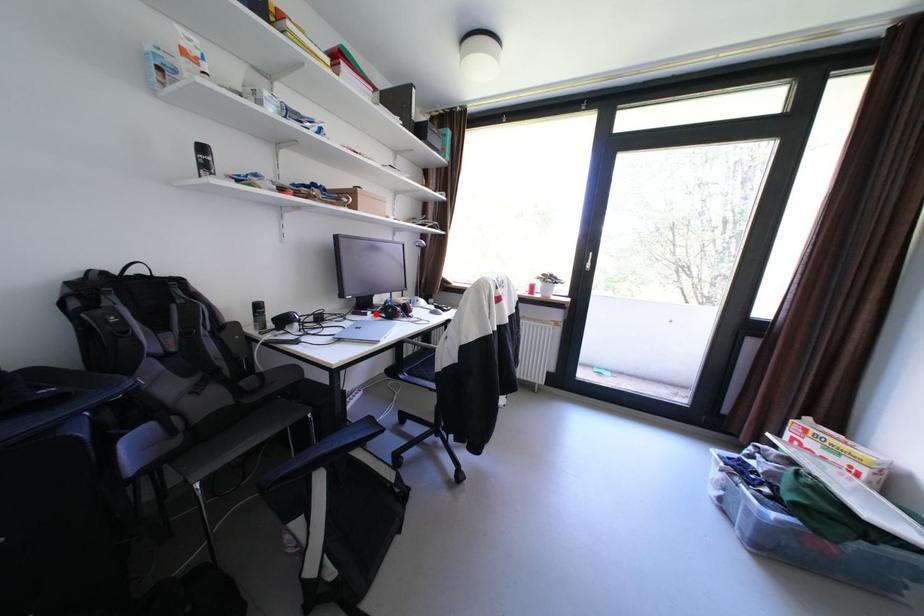
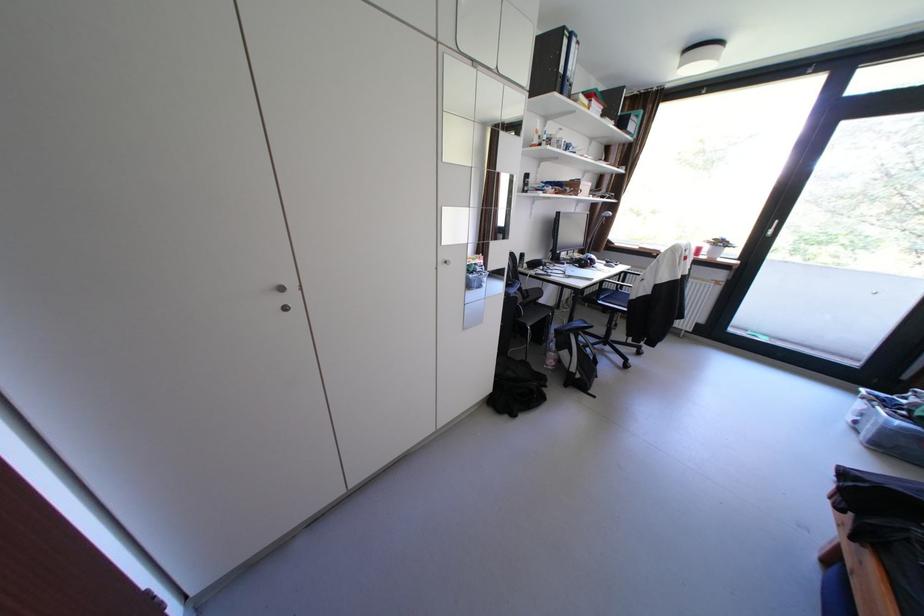
Locate, in the second image, the point that corresponds to the highlighted location in the first image.

(574, 264)